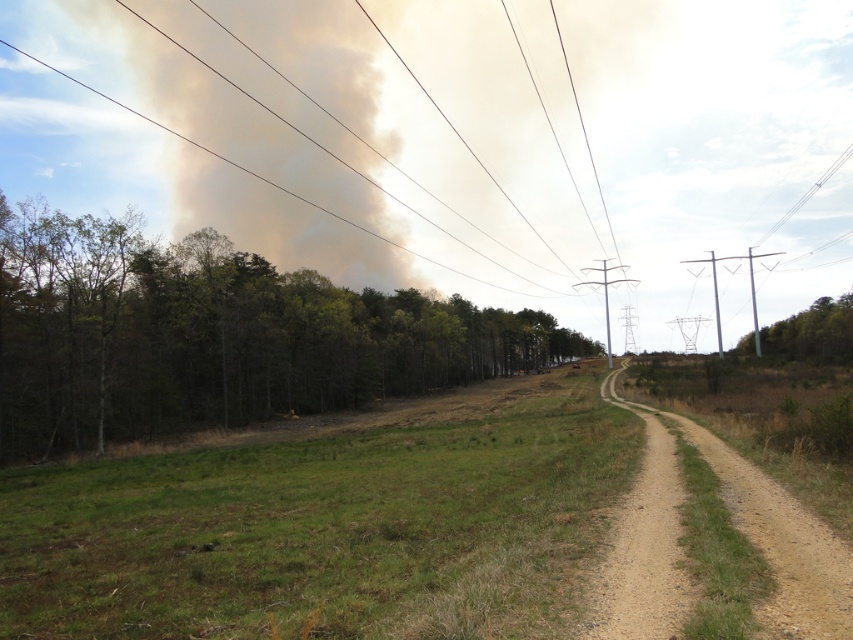
Question: Can you confirm if green leafy tree at right is positioned to the left of dark gray smoke at upper left?

Choices:
 (A) no
 (B) yes

Answer: (A)

Question: Which object is closer to the camera taking this photo?

Choices:
 (A) green leafy tree at right
 (B) dark gray smoke at upper left
 (C) dirt/gravel trail at center
 (D) green leafy trees at left

Answer: (C)

Question: Is green leafy trees at left further to camera compared to green leafy tree at right?

Choices:
 (A) no
 (B) yes

Answer: (A)

Question: Among these objects, which one is nearest to the camera?

Choices:
 (A) dirt/gravel trail at center
 (B) green leafy trees at left
 (C) dark gray smoke at upper left
 (D) green leafy tree at right

Answer: (A)

Question: Among these points, which one is nearest to the camera?

Choices:
 (A) (424, 260)
 (B) (100, 324)
 (C) (830, 346)

Answer: (B)

Question: Can you confirm if green leafy trees at left is positioned below green leafy tree at right?

Choices:
 (A) no
 (B) yes

Answer: (A)